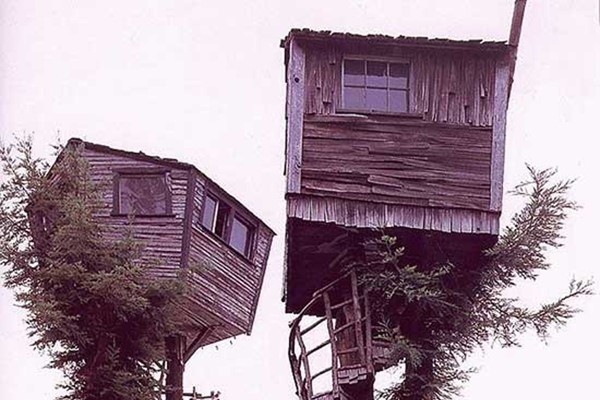
Locate an element on the screen. The image size is (600, 400). six section window pane is located at coordinates (351, 70), (376, 69), (402, 70), (400, 104), (383, 100), (359, 97).